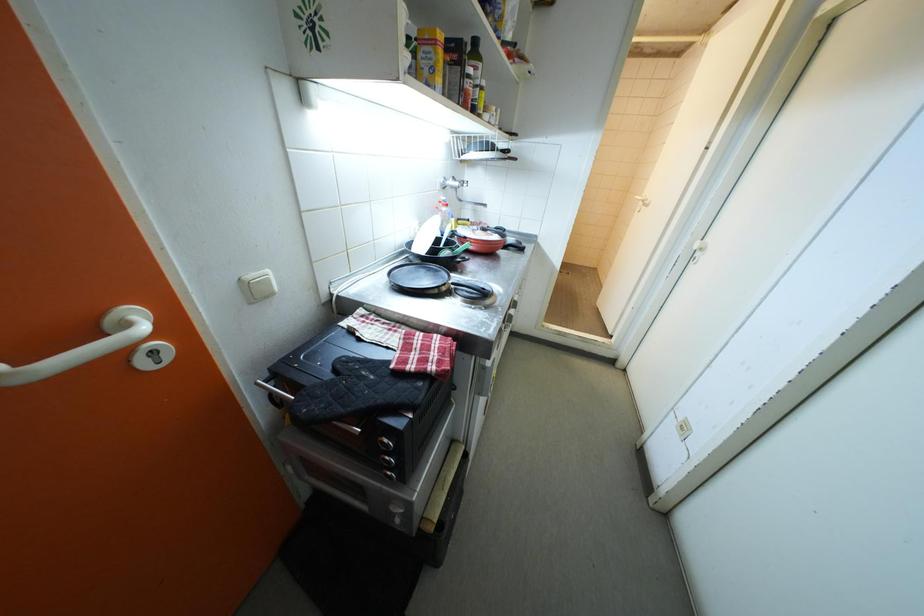
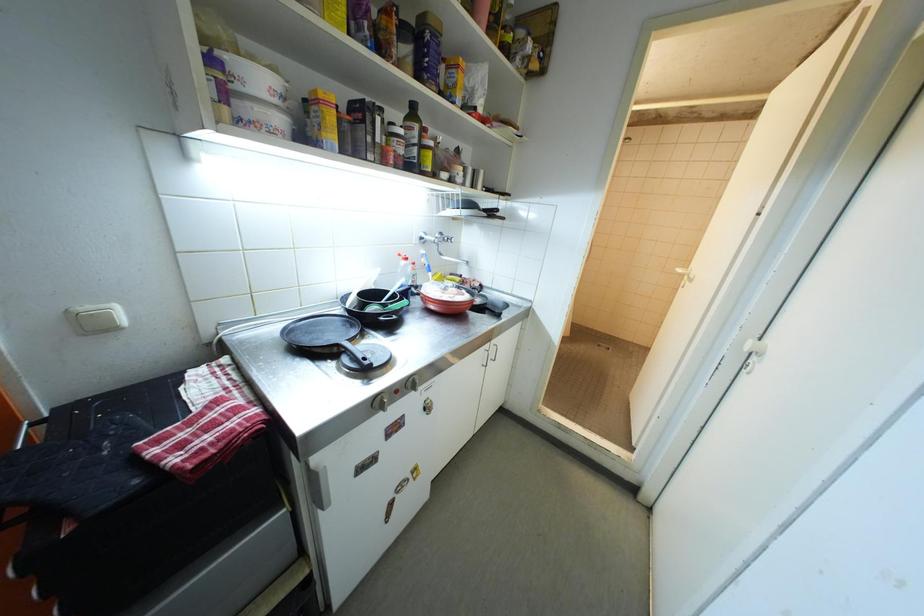
The images are taken continuously from a first-person perspective. In which direction are you moving?

The movement direction of the cameraman is right, forward.